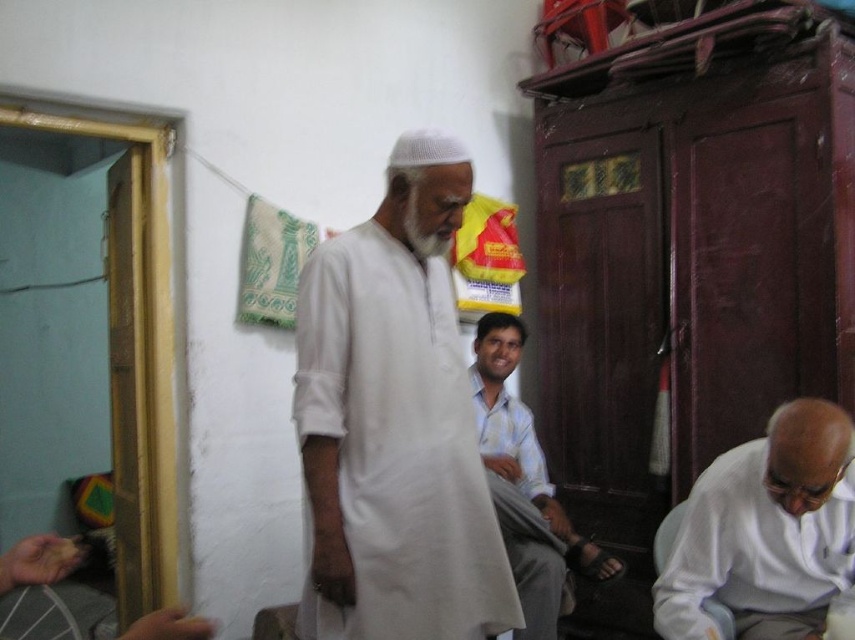
You are standing in the room and want to hand a document to both the white matte shirt at lower right and the light blue cotton shirt at center. Which person should you approach first to ensure you can reach them without moving?

You should approach the white matte shirt at lower right first because it is closer to the viewer than the light blue cotton shirt at center, so you can reach them without moving.

You are organizing a clothing donation drive and need to determine which item takes up more space in the donation box. Based on the image, which of the two items, the white cotton robe at center or the white matte shirt at lower right, is bigger in size?

The white cotton robe at center has a larger size compared to the white matte shirt at lower right, so it takes up more space in the donation box.